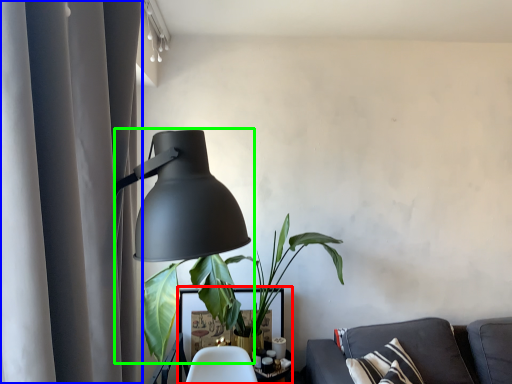
Question: Which object is positioned farthest from table (highlighted by a red box)? Select from curtain (highlighted by a blue box) and lamp (highlighted by a green box).

Choices:
 (A) curtain
 (B) lamp

Answer: (A)